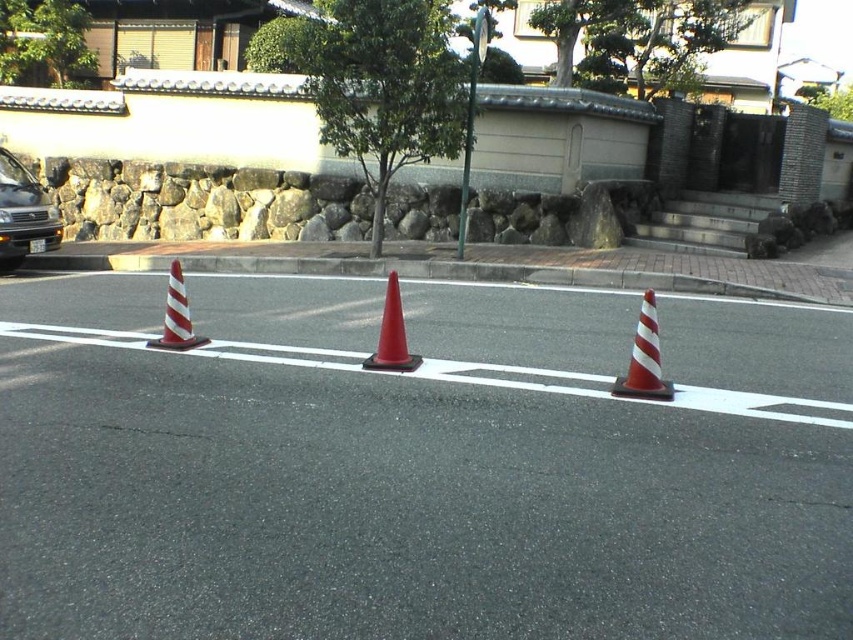
Between matte black car at left and metallic green traffic sign at center, which one appears on the right side from the viewer's perspective?

metallic green traffic sign at center is more to the right.

Is matte black car at left below metallic green traffic sign at center?

Correct, matte black car at left is located below metallic green traffic sign at center.

Which is behind, point (10, 216) or point (460, 227)?

The point (460, 227) is more distant.

Where is `matte black car at left`? This screenshot has height=640, width=853. matte black car at left is located at coordinates (24, 214).

Where is `white painted line at center`? white painted line at center is located at coordinates (192, 348).

Which is behind, point (329, 356) or point (657, 337)?

The point (329, 356) is more distant.

Is point (38, 337) positioned before point (648, 294)?

Yes, it is.

At what (x,y) coordinates should I click in order to perform the action: click on white painted line at center. Please return your answer as a coordinate pair (x, y). This screenshot has width=853, height=640. Looking at the image, I should click on (192, 348).

Is glossy plastic traffic cone at center bigger than metallic green traffic sign at center?

Incorrect, glossy plastic traffic cone at center is not larger than metallic green traffic sign at center.

Can you confirm if glossy plastic traffic cone at center is thinner than metallic green traffic sign at center?

Yes.

Between point (416, 356) and point (462, 220), which one is positioned in front?

Positioned in front is point (416, 356).

At what (x,y) coordinates should I click in order to perform the action: click on glossy plastic traffic cone at center. Please return your answer as a coordinate pair (x, y). This screenshot has width=853, height=640. Looking at the image, I should click on (392, 333).